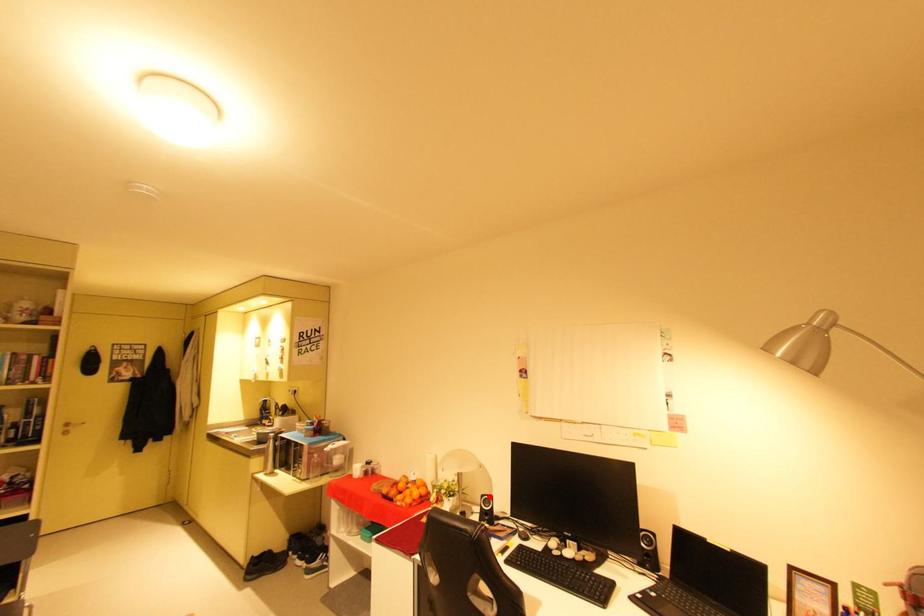
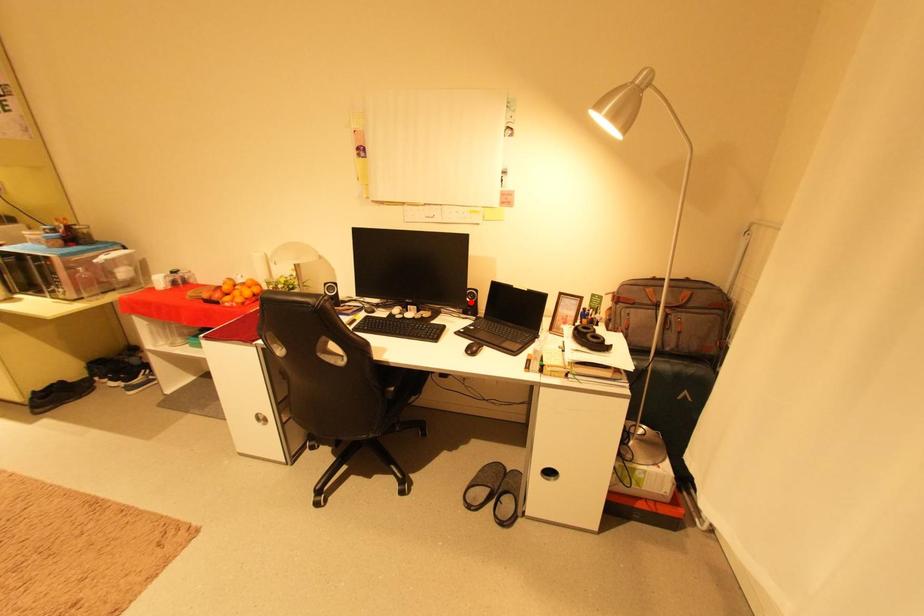
I am providing you with two images of the same scene from different viewpoints. A red point is marked on the first image and another point is marked on the second image. Is the marked point in image1 the same physical position as the marked point in image2?

No